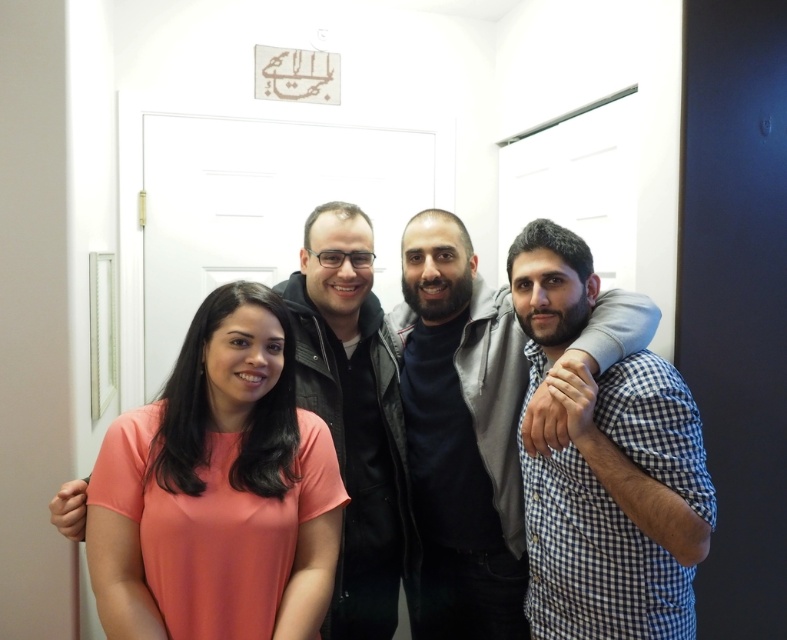
You are a photographer setting up for a group photo. You want to ensure that the blue checkered shirt at right and the dark gray sweater at center are both visible in the frame. Based on their heights, which clothing item should you adjust your camera angle to focus on to include both?

Since the blue checkered shirt at right is shorter than the dark gray sweater at center, you should lower the camera angle slightly to ensure both the shorter blue checkered shirt at right and taller dark gray sweater at center are visible.

You are a photographer trying to capture a clear shot of the blue checkered shirt at right and the dark gray sweater at center. Which of the two is positioned closer to the camera?

The blue checkered shirt at right is closer to the viewer than the dark gray sweater at center, so it is positioned closer to the camera.